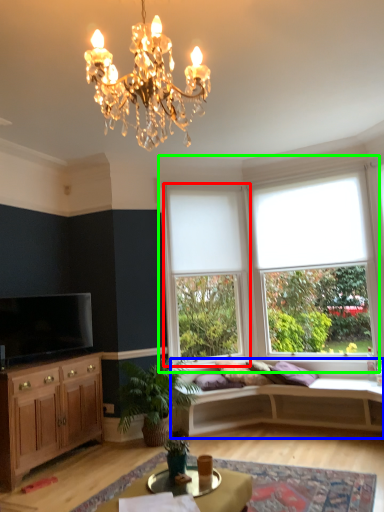
Question: Considering the real-world distances, which object is farthest from window (highlighted by a red box)? studio couch (highlighted by a blue box) or window (highlighted by a green box)?

Choices:
 (A) studio couch
 (B) window

Answer: (A)